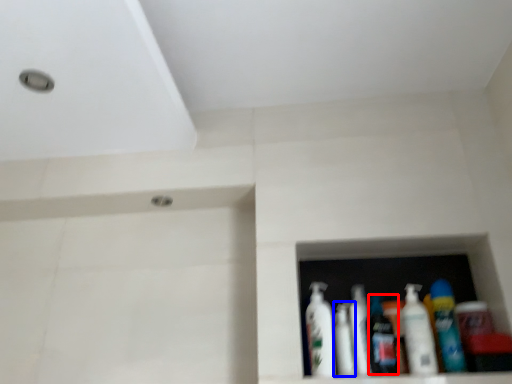
Question: Which object appears farthest to the camera in this image, toiletry (highlighted by a red box) or mouthwash (highlighted by a blue box)?

Choices:
 (A) toiletry
 (B) mouthwash

Answer: (B)